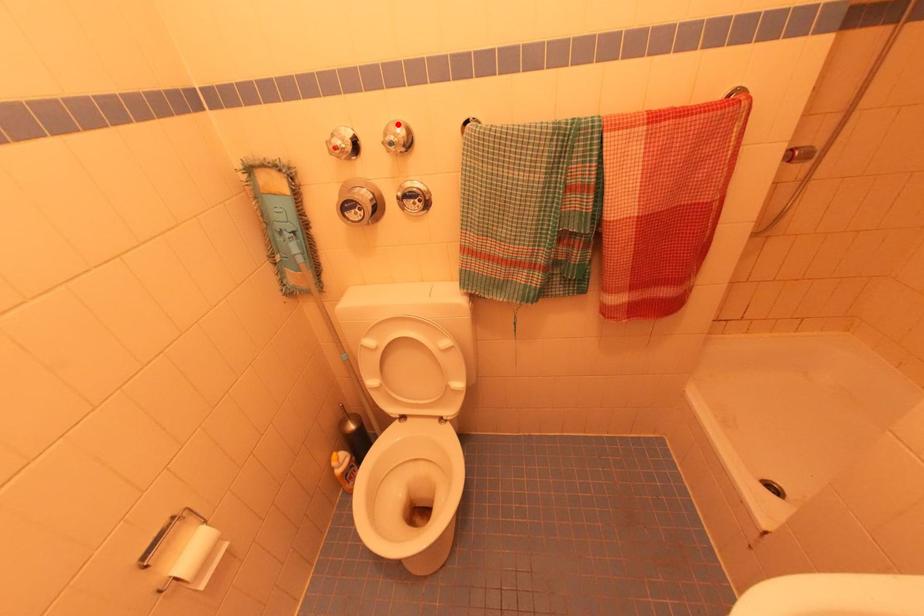
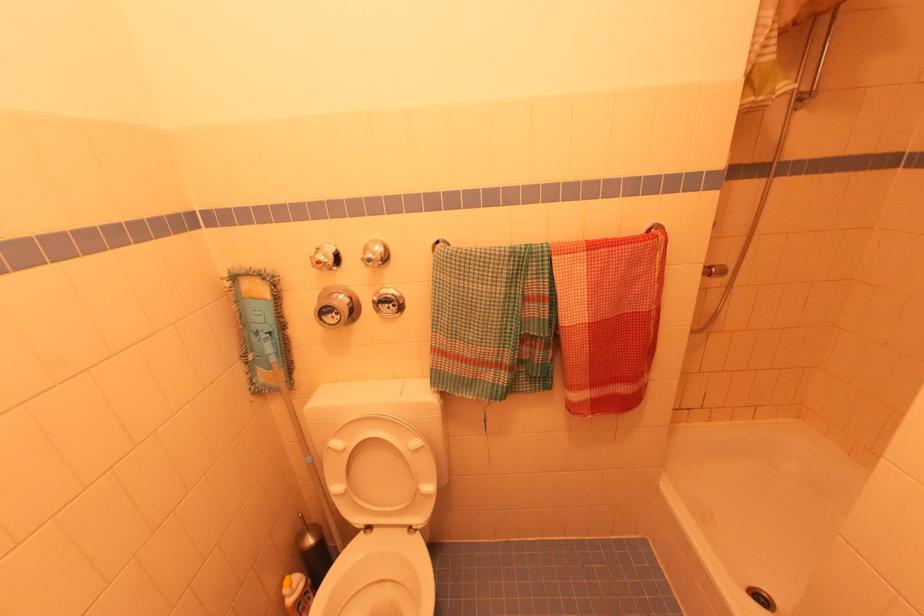
Find the pixel in the second image that matches the highlighted location in the first image.

(377, 243)